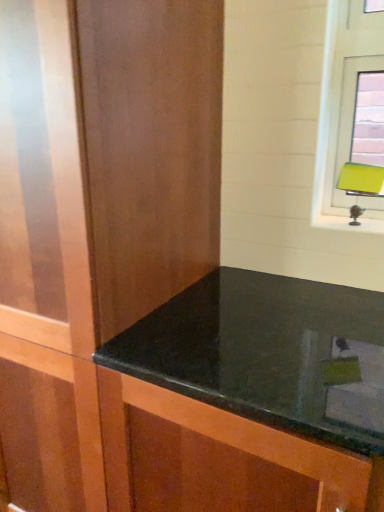
Question: Is matte wood dresser at center closer to the viewer compared to green matte table lamp at upper right?

Choices:
 (A) no
 (B) yes

Answer: (B)

Question: Considering the relative sizes of matte wood dresser at center and green matte table lamp at upper right in the image provided, is matte wood dresser at center taller than green matte table lamp at upper right?

Choices:
 (A) no
 (B) yes

Answer: (B)

Question: Is matte wood dresser at center positioned with its back to green matte table lamp at upper right?

Choices:
 (A) no
 (B) yes

Answer: (A)

Question: Can you confirm if matte wood dresser at center is positioned to the left of green matte table lamp at upper right?

Choices:
 (A) no
 (B) yes

Answer: (B)

Question: Can you confirm if matte wood dresser at center is thinner than green matte table lamp at upper right?

Choices:
 (A) yes
 (B) no

Answer: (B)

Question: From the image's perspective, is green matte table lamp at upper right above or below black granite countertop at center?

Choices:
 (A) above
 (B) below

Answer: (A)

Question: In terms of height, does green matte table lamp at upper right look taller or shorter compared to black granite countertop at center?

Choices:
 (A) tall
 (B) short

Answer: (B)

Question: Based on their sizes in the image, would you say green matte table lamp at upper right is bigger or smaller than black granite countertop at center?

Choices:
 (A) big
 (B) small

Answer: (B)

Question: From a real-world perspective, relative to black granite countertop at center, is green matte table lamp at upper right vertically above or below?

Choices:
 (A) below
 (B) above

Answer: (B)

Question: From their relative heights in the image, would you say matte wood dresser at center is taller or shorter than green matte table lamp at upper right?

Choices:
 (A) short
 (B) tall

Answer: (B)

Question: Considering the positions of matte wood dresser at center and green matte table lamp at upper right in the image, is matte wood dresser at center bigger or smaller than green matte table lamp at upper right?

Choices:
 (A) big
 (B) small

Answer: (A)

Question: From the image's perspective, relative to green matte table lamp at upper right, is matte wood dresser at center above or below?

Choices:
 (A) above
 (B) below

Answer: (B)

Question: Considering the positions of matte wood dresser at center and green matte table lamp at upper right in the image, is matte wood dresser at center wider or thinner than green matte table lamp at upper right?

Choices:
 (A) thin
 (B) wide

Answer: (B)

Question: Considering the positions of point (211, 122) and point (225, 371), is point (211, 122) closer or farther from the camera than point (225, 371)?

Choices:
 (A) closer
 (B) farther

Answer: (B)

Question: In the image, is matte wood dresser at center on the left side or the right side of black granite countertop at center?

Choices:
 (A) right
 (B) left

Answer: (B)